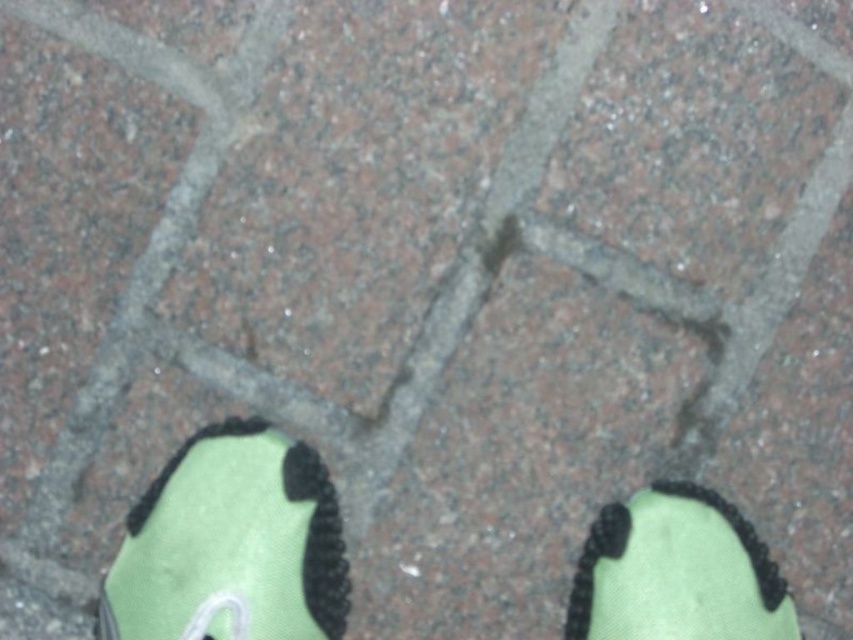
Is green fabric shoe at lower center above green fabric shoe at lower right?

Indeed, green fabric shoe at lower center is positioned over green fabric shoe at lower right.

Who is more distant from viewer, (292, 477) or (675, 632)?

The point (292, 477) is more distant.

Image resolution: width=853 pixels, height=640 pixels. I want to click on green fabric shoe at lower center, so click(x=231, y=544).

Where is `green fabric shoe at lower center`? This screenshot has width=853, height=640. green fabric shoe at lower center is located at coordinates (231, 544).